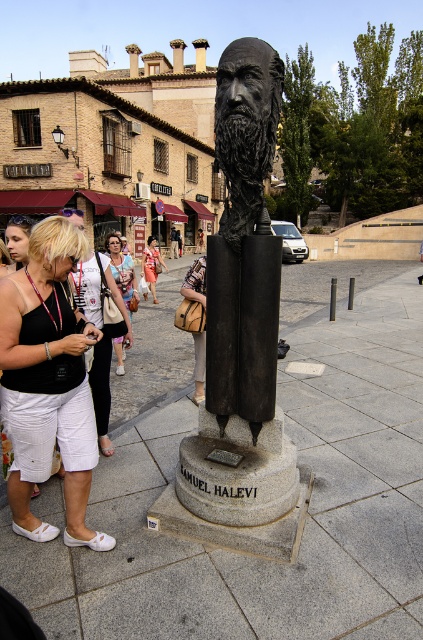
Consider the image. You are standing in the public square and want to place a new bench exactly at the point marked as point (195, 282). However, there is an object already there. What object is blocking the bench placement at that point?

The leather brown bag at lower center is located at point (195, 282), so the object blocking the bench placement is the leather brown bag at lower center.

You are a photographer standing in the public square. You have a camera and want to capture both the leather brown bag at lower center and the denim skirt at center in a single shot. Which object should you focus on to ensure both are in frame without zooming in or out?

The leather brown bag at lower center has a lesser width compared to denim skirt at center, so focusing on the denim skirt at center would allow both objects to fit within the frame since it takes up more space.